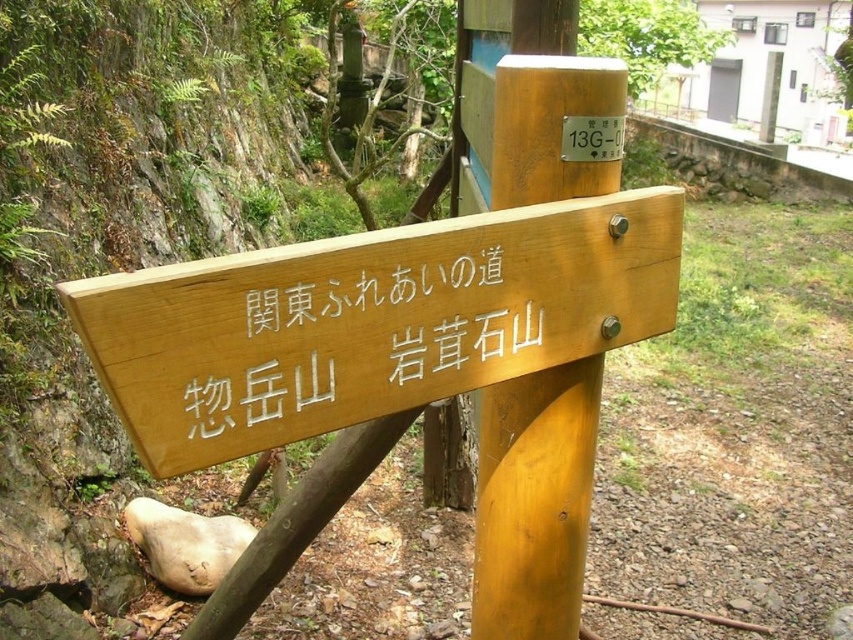
Image resolution: width=853 pixels, height=640 pixels. Describe the element at coordinates (352, 333) in the screenshot. I see `wooden sign at center` at that location.

In the scene shown: Is wooden sign at center positioned before wooden signpost at center?

Yes, wooden sign at center is in front of wooden signpost at center.

Describe the element at coordinates (352, 333) in the screenshot. I see `wooden sign at center` at that location.

In order to click on wooden sign at center in this screenshot , I will do `click(352, 333)`.

Is natural wood sign at center below wooden sign at center?

Correct, natural wood sign at center is located below wooden sign at center.

Is natural wood sign at center thinner than wooden sign at center?

No, natural wood sign at center is not thinner than wooden sign at center.

Between point (123, 372) and point (410, 362), which one is positioned behind?

Point (410, 362)

Identify the location of natural wood sign at center. (370, 321).

Who is more forward, [132,291] or [583,99]?

A: Point [132,291] is in front.

Is the position of natural wood sign at center more distant than that of wooden signpost at center?

No.

Between point (198, 465) and point (498, 132), which one is positioned behind?

The point (498, 132) is more distant.

I want to click on natural wood sign at center, so click(x=370, y=321).